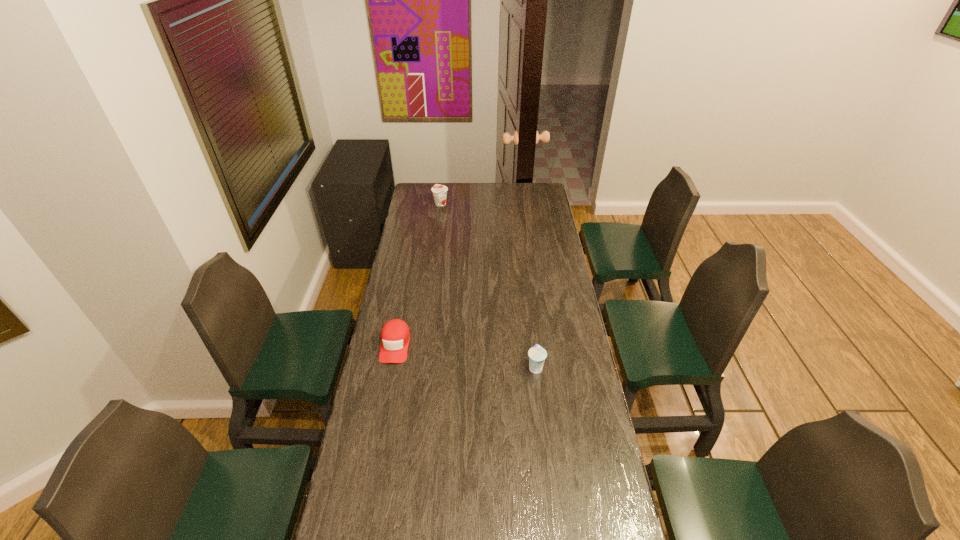
At what (x,y) coordinates should I click in order to perform the action: click on free space that is in between the leftmost object and the rightmost object. Please return your answer as a coordinate pair (x, y). The height and width of the screenshot is (540, 960). Looking at the image, I should click on (466, 356).

The height and width of the screenshot is (540, 960). Identify the location of unoccupied position between the right yogurt and the leftmost object. (466, 356).

The width and height of the screenshot is (960, 540). Find the location of `vacant point located between the rightmost object and the leftmost object`. vacant point located between the rightmost object and the leftmost object is located at coordinates (466, 356).

This screenshot has width=960, height=540. Identify the location of vacant space in between the second object from left to right and the right yogurt. (488, 286).

Locate an element on the screen. This screenshot has width=960, height=540. free space between the leftmost object and the left yogurt is located at coordinates (418, 274).

This screenshot has width=960, height=540. I want to click on free space between the right yogurt and the baseball cap, so (466, 356).

Locate which object is the closest to the left yogurt. Please provide its 2D coordinates. Your answer should be formatted as a tuple, i.e. [(x, y)], where the tuple contains the x and y coordinates of a point satisfying the conditions above.

[(395, 335)]

At what (x,y) coordinates should I click in order to perform the action: click on object that is the closest to the farther yogurt. Please return your answer as a coordinate pair (x, y). Looking at the image, I should click on (395, 335).

Find the location of a particular element. The width and height of the screenshot is (960, 540). vacant area that satisfies the following two spatial constraints: 1. on the front-facing side of the rightmost object; 2. on the left side of the baseball cap is located at coordinates pos(391,367).

Where is `vacant space that satisfies the following two spatial constraints: 1. on the front-facing side of the rightmost object; 2. on the left side of the leftmost object`? vacant space that satisfies the following two spatial constraints: 1. on the front-facing side of the rightmost object; 2. on the left side of the leftmost object is located at coordinates (391, 367).